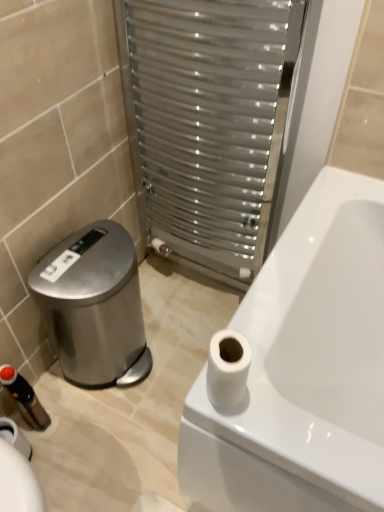
Question: From the image's perspective, is white matte toilet paper at upper right above or below black plastic toiletry at lower left?

Choices:
 (A) above
 (B) below

Answer: (A)

Question: Would you say white matte toilet paper at upper right is to the left or to the right of black plastic toiletry at lower left in the picture?

Choices:
 (A) left
 (B) right

Answer: (B)

Question: Estimate the real-world distances between objects in this image. Which object is closer to the polished stainless steel water cooler at lower left?

Choices:
 (A) metallic silver radiator at center
 (B) black plastic toiletry at lower left
 (C) white matte toilet paper at upper right

Answer: (B)

Question: Estimate the real-world distances between objects in this image. Which object is farther from the metallic silver radiator at center?

Choices:
 (A) polished stainless steel water cooler at lower left
 (B) white matte toilet paper at upper right
 (C) black plastic toiletry at lower left

Answer: (C)